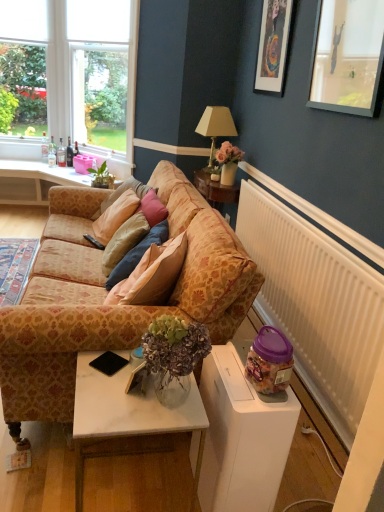
Locate an element on the screen. The width and height of the screenshot is (384, 512). vacant space in front of black matte phone at lower center is located at coordinates (109, 397).